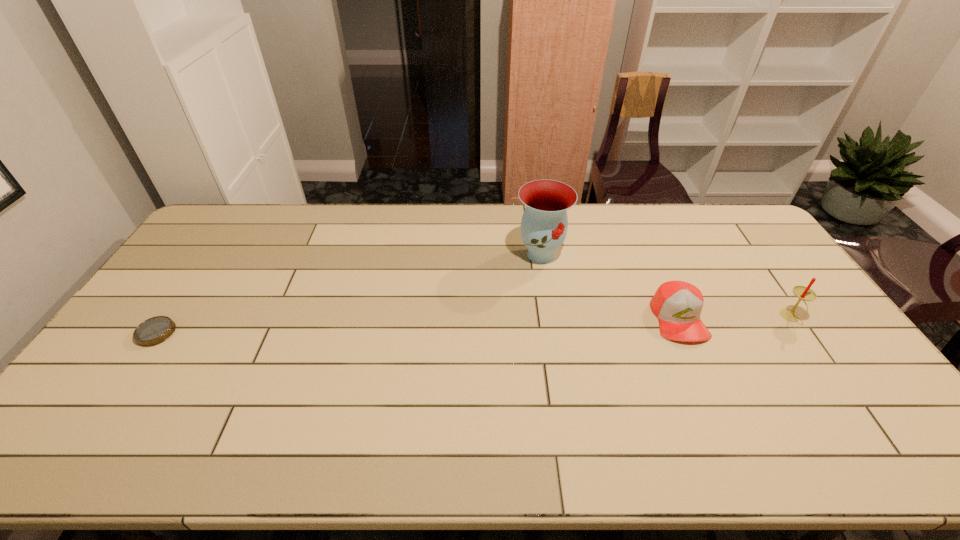
The width and height of the screenshot is (960, 540). What are the coordinates of `empty space between the second tallest object and the third object from left to right` in the screenshot? It's located at pyautogui.click(x=734, y=318).

Where is `free space between the shortest object and the third shortest object`? free space between the shortest object and the third shortest object is located at coordinates coord(473,325).

The width and height of the screenshot is (960, 540). I want to click on free space between the vase and the compass, so click(348, 294).

The height and width of the screenshot is (540, 960). Identify the location of free space between the third tallest object and the candle. pyautogui.click(x=734, y=318).

Find the location of a particular element. vacant point located between the candle and the third tallest object is located at coordinates (734, 318).

This screenshot has height=540, width=960. Identify the location of empty space that is in between the leftmost object and the third object from left to right. (418, 326).

Find the location of `unoccupied position between the second object from right to left and the vase`. unoccupied position between the second object from right to left and the vase is located at coordinates (610, 286).

I want to click on vacant space that is in between the third object from right to left and the baseball cap, so click(x=610, y=286).

I want to click on free area in between the compass and the candle, so click(x=473, y=325).

Locate an element on the screen. The height and width of the screenshot is (540, 960). object that is the third closest one to the vase is located at coordinates [153, 331].